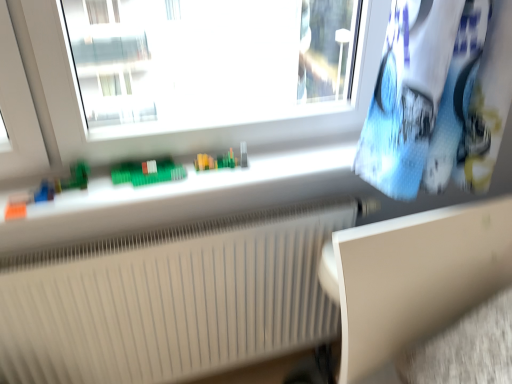
Question: Does white matte table at lower right appear on the left side of white ribbed radiator at lower center?

Choices:
 (A) yes
 (B) no

Answer: (B)

Question: Considering the relative sizes of white matte table at lower right and white ribbed radiator at lower center in the image provided, is white matte table at lower right smaller than white ribbed radiator at lower center?

Choices:
 (A) no
 (B) yes

Answer: (B)

Question: Is white matte table at lower right in contact with white ribbed radiator at lower center?

Choices:
 (A) no
 (B) yes

Answer: (A)

Question: Considering the relative sizes of white matte table at lower right and white ribbed radiator at lower center in the image provided, is white matte table at lower right shorter than white ribbed radiator at lower center?

Choices:
 (A) yes
 (B) no

Answer: (A)

Question: Can you confirm if white matte table at lower right is positioned to the right of white ribbed radiator at lower center?

Choices:
 (A) yes
 (B) no

Answer: (A)

Question: Is white matte table at lower right taller than white ribbed radiator at lower center?

Choices:
 (A) no
 (B) yes

Answer: (A)

Question: Is white ribbed radiator at lower center directly adjacent to white matte table at lower right?

Choices:
 (A) no
 (B) yes

Answer: (A)

Question: Does white ribbed radiator at lower center have a greater height compared to white matte table at lower right?

Choices:
 (A) yes
 (B) no

Answer: (A)

Question: Is white ribbed radiator at lower center oriented towards white matte table at lower right?

Choices:
 (A) yes
 (B) no

Answer: (A)

Question: Is white ribbed radiator at lower center shorter than white matte table at lower right?

Choices:
 (A) no
 (B) yes

Answer: (A)

Question: Does white ribbed radiator at lower center have a smaller size compared to white matte table at lower right?

Choices:
 (A) no
 (B) yes

Answer: (A)

Question: From a real-world perspective, is white ribbed radiator at lower center on top of white matte table at lower right?

Choices:
 (A) no
 (B) yes

Answer: (A)

Question: From the image's perspective, is white matte table at lower right above or below white ribbed radiator at lower center?

Choices:
 (A) below
 (B) above

Answer: (B)